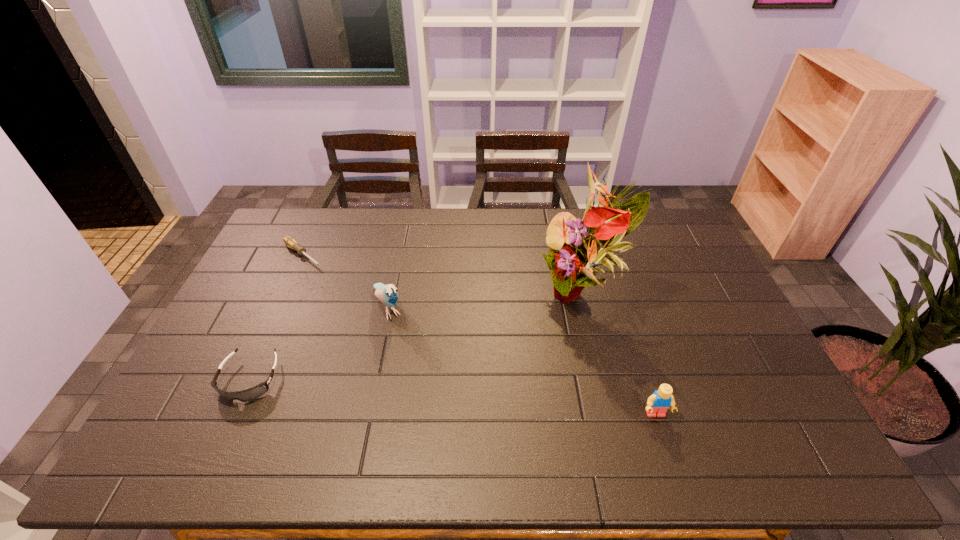
At what (x,y) coordinates should I click in order to perform the action: click on vacant space on the desktop that is between the fourth tallest object and the nearest object and is positioned on the front-facing side of the bouquet. Please return your answer as a coordinate pair (x, y). The height and width of the screenshot is (540, 960). Looking at the image, I should click on (467, 398).

The width and height of the screenshot is (960, 540). I want to click on vacant spot on the desktop that is between the goggles and the third shortest object and is positioned at the face of the fourth shortest object, so click(x=437, y=395).

Find the location of `vacant space on the desktop that is between the second nearest object and the nearest object and is positioned at the tip of the screwdriver`. vacant space on the desktop that is between the second nearest object and the nearest object and is positioned at the tip of the screwdriver is located at coordinates (483, 400).